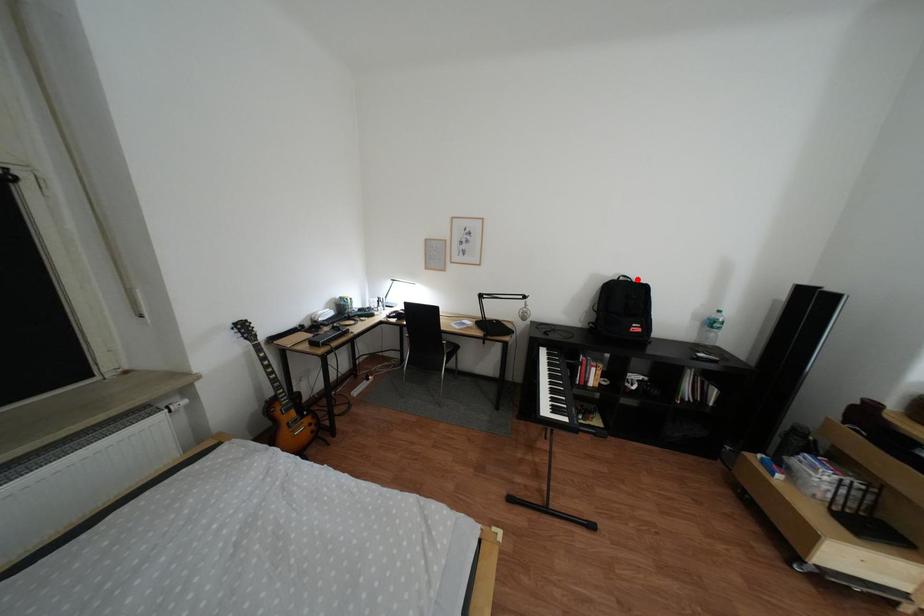
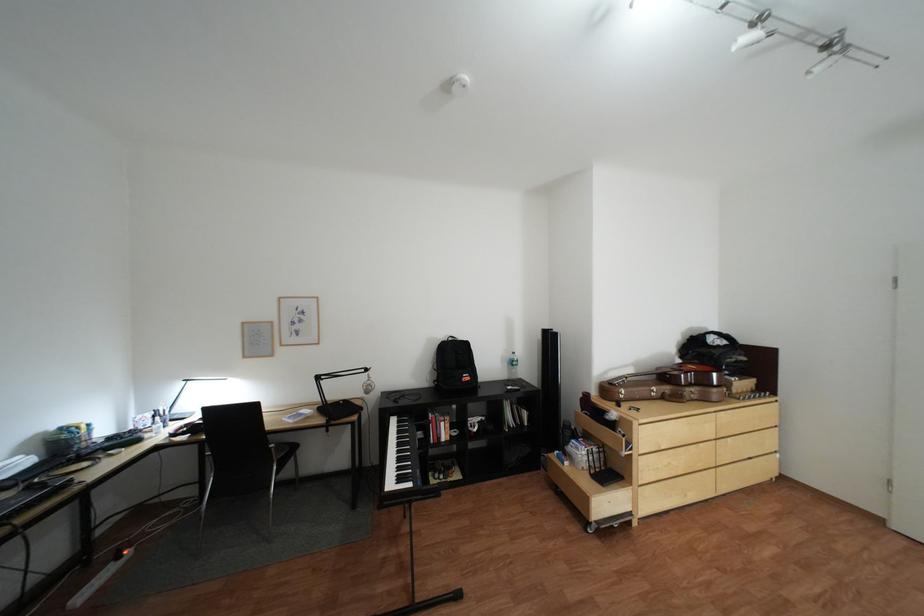
The point at the highlighted location is marked in the first image. Where is the corresponding point in the second image?

(466, 339)